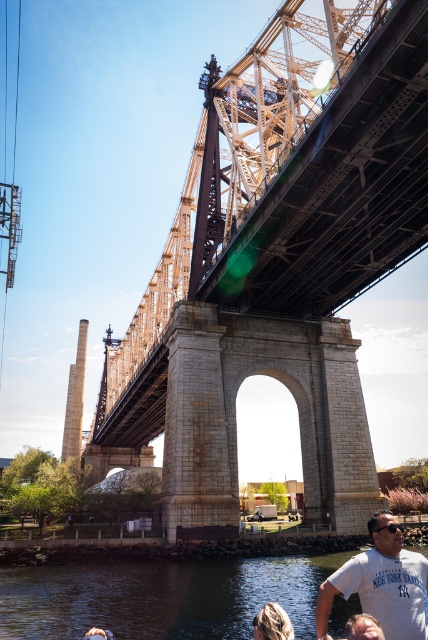
Which is in front, point (323, 189) or point (77, 572)?

Point (323, 189)

Measure the distance between point (214, 177) and camera.

Point (214, 177) and camera are 293.30 feet apart from each other.

Image resolution: width=428 pixels, height=640 pixels. What are the coordinates of `rusty metal bridge at center` in the screenshot? It's located at (279, 262).

Where is `rusty metal bridge at center`? The image size is (428, 640). rusty metal bridge at center is located at coordinates (279, 262).

This screenshot has height=640, width=428. Describe the element at coordinates (279, 262) in the screenshot. I see `rusty metal bridge at center` at that location.

Looking at this image, can you confirm if rusty metal bridge at center is positioned above white cotton t-shirt at lower right?

Yes.

Which is behind, point (312, 234) or point (398, 540)?

Point (312, 234)

I want to click on rusty metal bridge at center, so click(x=279, y=262).

Is clear water at lower center closer to the viewer compared to white cotton t-shirt at lower right?

No, clear water at lower center is further to the viewer.

Does point (275, 588) lie behind point (395, 518)?

Yes, it is behind point (395, 518).

Where is `clear water at lower center`? clear water at lower center is located at coordinates (160, 596).